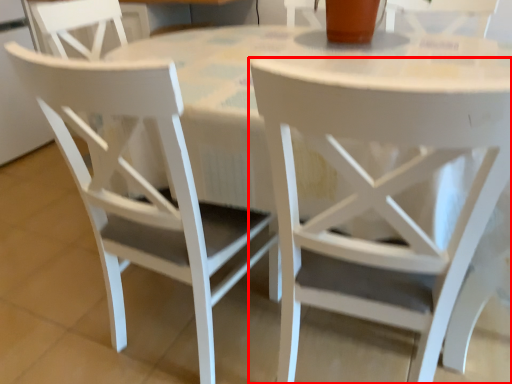
Question: Where is chair (annotated by the red box) located in relation to chair in the image?

Choices:
 (A) right
 (B) left

Answer: (A)